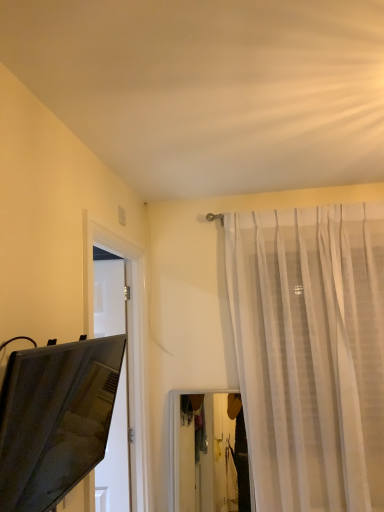
In order to click on sheer white curtain at upper right in this screenshot , I will do `click(311, 353)`.

What do you see at coordinates (311, 353) in the screenshot?
I see `sheer white curtain at upper right` at bounding box center [311, 353].

Locate an element on the screen. Image resolution: width=384 pixels, height=512 pixels. sheer white curtain at upper right is located at coordinates (311, 353).